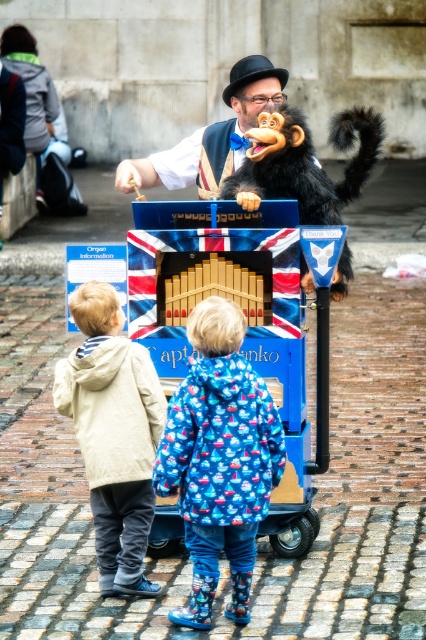
Which is above, blue painted wooden organ at center or blue printed coat at center?

blue painted wooden organ at center

Who is taller, blue painted wooden organ at center or blue printed coat at center?

Standing taller between the two is blue painted wooden organ at center.

In order to click on blue painted wooden organ at center in this screenshot , I will do `click(242, 312)`.

At what (x,y) coordinates should I click in order to perform the action: click on blue painted wooden organ at center. Please return your answer as a coordinate pair (x, y). Image resolution: width=426 pixels, height=640 pixels. Looking at the image, I should click on (242, 312).

Is point (160, 538) positioned before point (129, 460)?

No.

Identify the location of blue painted wooden organ at center. (242, 312).

Does blue printed coat at center appear on the left side of shiny black fur monkey at center?

Yes, blue printed coat at center is to the left of shiny black fur monkey at center.

Consider the image. Which is more to the right, blue printed coat at center or shiny black fur monkey at center?

shiny black fur monkey at center is more to the right.

This screenshot has height=640, width=426. What do you see at coordinates (219, 460) in the screenshot?
I see `blue printed coat at center` at bounding box center [219, 460].

At what (x,y) coordinates should I click in order to perform the action: click on blue printed coat at center. Please return your answer as a coordinate pair (x, y). The height and width of the screenshot is (640, 426). Looking at the image, I should click on (219, 460).